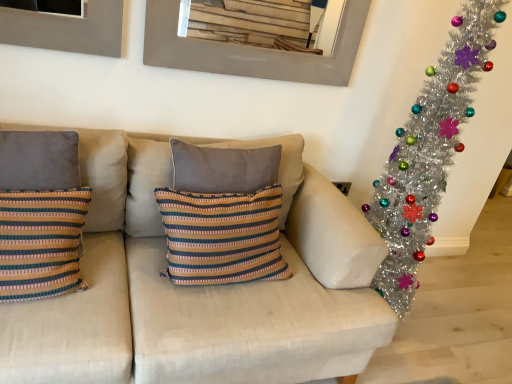
Question: Would you say metallic gray picture frame at upper center is to the left or to the right of striped fabric cushion at center, which is the first pillow from right to left, in the picture?

Choices:
 (A) left
 (B) right

Answer: (B)

Question: Looking at their shapes, would you say metallic gray picture frame at upper center is wider or thinner than striped fabric cushion at center, the second pillow positioned from the left?

Choices:
 (A) thin
 (B) wide

Answer: (A)

Question: Estimate the real-world distances between objects in this image. Which object is farther from the striped fabric pillow at left, the first pillow viewed from the left?

Choices:
 (A) textured beige couch at center
 (B) shiny silver tinsel garland at right
 (C) striped fabric cushion at center, the second pillow positioned from the left
 (D) metallic gray picture frame at upper center

Answer: (B)

Question: Based on their relative distances, which object is nearer to the textured beige couch at center?

Choices:
 (A) shiny silver tinsel garland at right
 (B) striped fabric cushion at center, the second pillow positioned from the left
 (C) striped fabric pillow at left, the first pillow viewed from the left
 (D) metallic gray picture frame at upper center

Answer: (B)